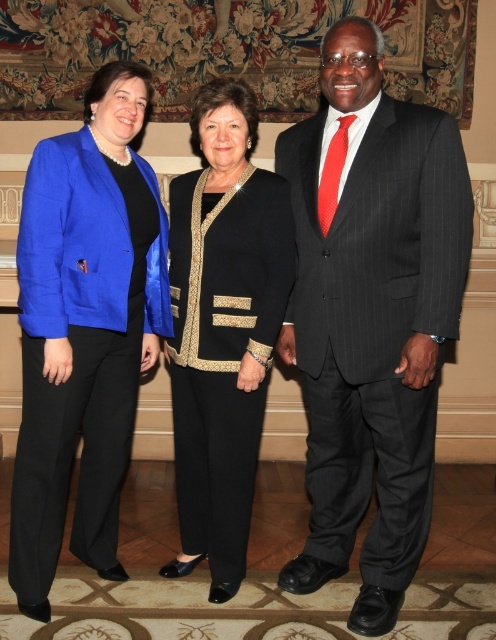
Does matte blue blazer at left have a lesser width compared to black textured pants at center?

Incorrect, matte blue blazer at left's width is not less than black textured pants at center's.

Measure the distance between matte blue blazer at left and black textured pants at center.

matte blue blazer at left and black textured pants at center are 11.75 inches apart from each other.

Find the location of a particular element. matte blue blazer at left is located at coordinates (80, 348).

You are a GUI agent. You are given a task and a screenshot of the screen. Output one action in this format:
    pyautogui.click(x=<x>, y=<y>)
    Task: Click on the matte blue blazer at left
    This screenshot has height=640, width=496.
    Given the screenshot: What is the action you would take?
    pyautogui.click(x=80, y=348)

Is pinstriped suit at center to the right of black textured pants at center from the viewer's perspective?

Correct, you'll find pinstriped suit at center to the right of black textured pants at center.

Between point (368, 250) and point (248, 276), which one is positioned behind?

Point (248, 276)

Does point (357, 406) come in front of point (188, 560)?

Yes, it is.

This screenshot has height=640, width=496. What are the coordinates of `pinstriped suit at center` in the screenshot? It's located at (371, 314).

Does pinstriped suit at center have a larger size compared to matte blue blazer at left?

Correct, pinstriped suit at center is larger in size than matte blue blazer at left.

Between pinstriped suit at center and matte blue blazer at left, which one appears on the left side from the viewer's perspective?

matte blue blazer at left

The image size is (496, 640). Find the location of `pinstriped suit at center`. pinstriped suit at center is located at coordinates tap(371, 314).

Where is `pinstriped suit at center`? pinstriped suit at center is located at coordinates (371, 314).